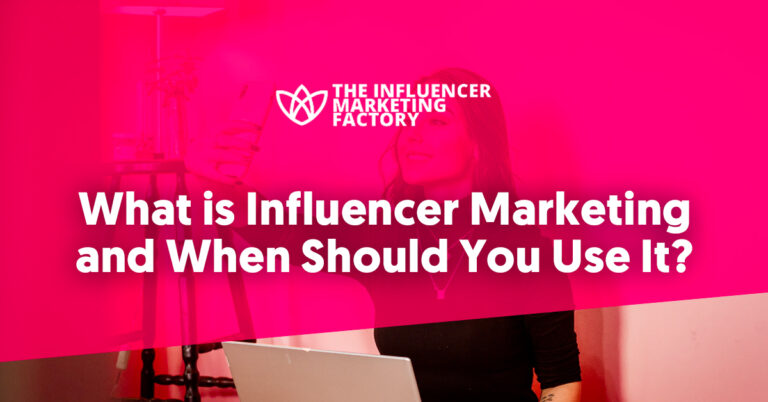
At what (x,y) coordinates should I click in order to perform the action: click on laptop. Please return your answer as a coordinate pair (x, y). Looking at the image, I should click on (339, 361).